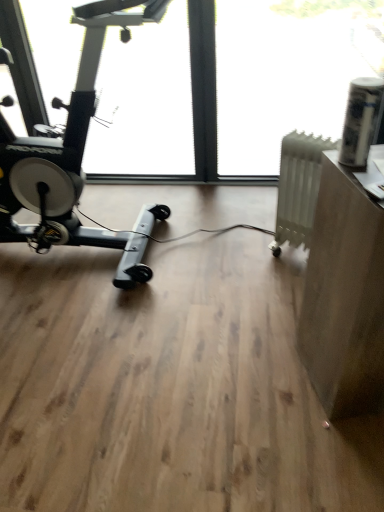
At what (x,y) coordinates should I click in order to perform the action: click on vacant region to the left of matte brown desk at right. Please return your answer as a coordinate pair (x, y). The image size is (384, 512). Looking at the image, I should click on (265, 384).